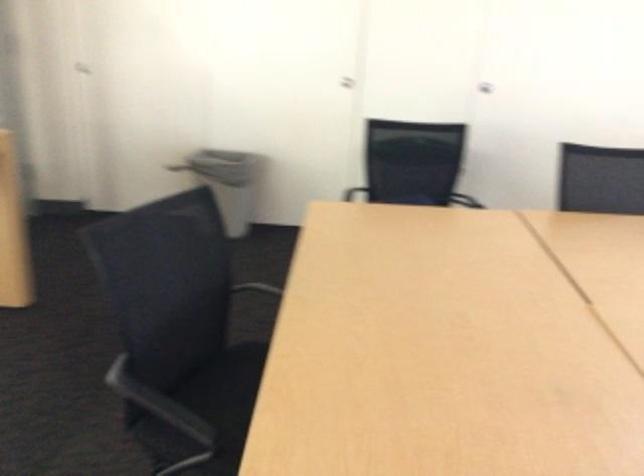
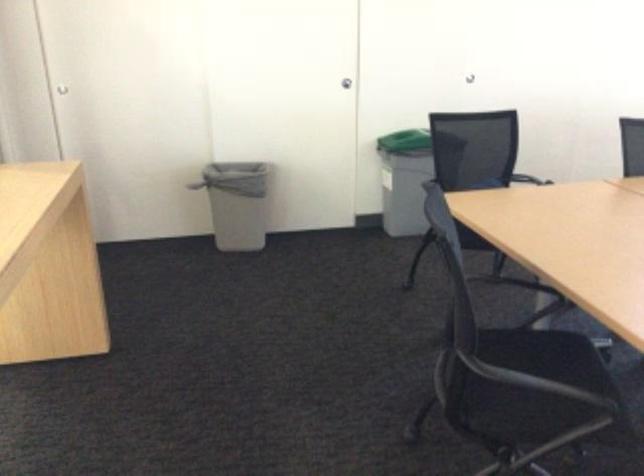
Locate, in the second image, the point that corresponds to point 337,131 in the first image.

(345, 83)